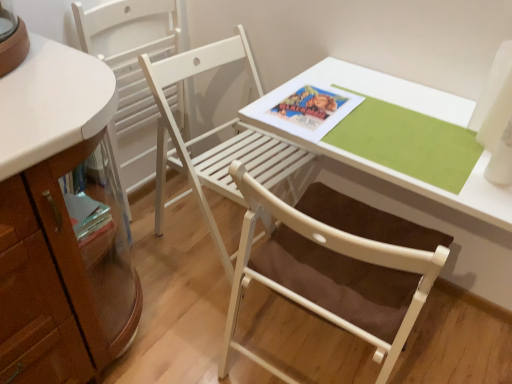
Question: From the image's perspective, is white wood table at center located above or below white wood chair at center, acting as the first chair starting from the right?

Choices:
 (A) above
 (B) below

Answer: (B)

Question: From a real-world perspective, relative to white wood chair at center, the second chair from the left, is white wood table at center vertically above or below?

Choices:
 (A) below
 (B) above

Answer: (B)

Question: Which object is the farthest from the white wood table at center?

Choices:
 (A) white wood chair at center, the second chair from the left
 (B) white wood chair at left, positioned as the 1th chair in left-to-right order

Answer: (B)

Question: Based on their relative distances, which object is farther from the white wood chair at center, the second chair from the left?

Choices:
 (A) white wood table at center
 (B) white wood chair at left, the second chair when ordered from right to left

Answer: (A)